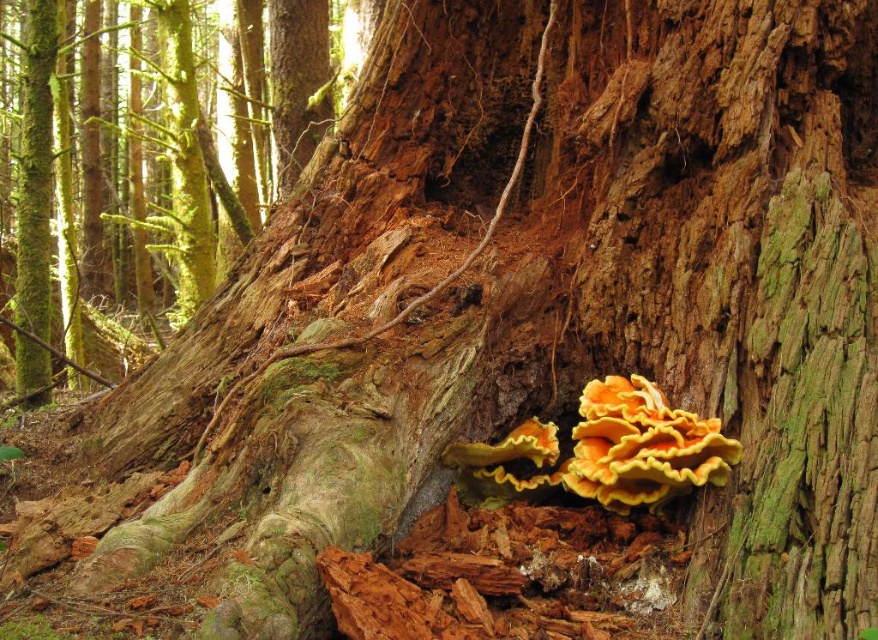
Is orange/yellow polypore at center positioned in front of smooth bark tree trunk at center?

Yes, it is.

Between orange/yellow polypore at center and smooth bark tree trunk at center, which one has less height?

With less height is orange/yellow polypore at center.

Is point (581, 490) less distant than point (176, 182)?

Yes, it is in front of point (176, 182).

I want to click on orange/yellow polypore at center, so click(x=608, y=449).